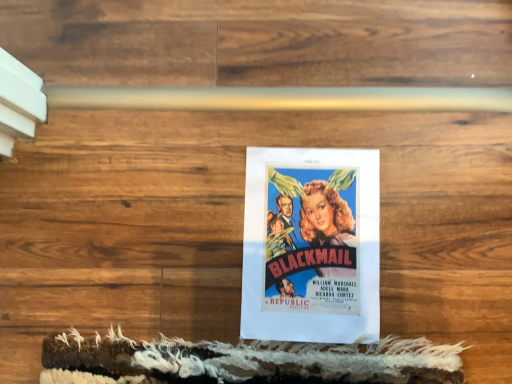
Find the location of a particular element. matte paper poster at center is located at coordinates (311, 245).

Describe the element at coordinates (311, 245) in the screenshot. The height and width of the screenshot is (384, 512). I see `matte paper poster at center` at that location.

You are a GUI agent. You are given a task and a screenshot of the screen. Output one action in this format:
    pyautogui.click(x=<x>, y=<y>)
    Task: Click on the matte paper poster at center
    This screenshot has width=512, height=384.
    Given the screenshot: What is the action you would take?
    pyautogui.click(x=311, y=245)